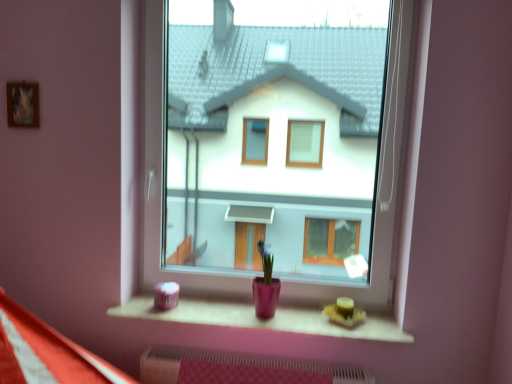
Question: Is wooden frame at upper left in front of or behind matte pink wood at lower center in the image?

Choices:
 (A) behind
 (B) front

Answer: (A)

Question: From their relative heights in the image, would you say wooden frame at upper left is taller or shorter than matte pink wood at lower center?

Choices:
 (A) short
 (B) tall

Answer: (B)

Question: Which is farther from the matte pink wood at lower center?

Choices:
 (A) transparent glass window at center
 (B) wooden frame at upper left

Answer: (A)

Question: Which of these objects is positioned closest to the transparent glass window at center?

Choices:
 (A) matte pink wood at lower center
 (B) wooden frame at upper left

Answer: (A)